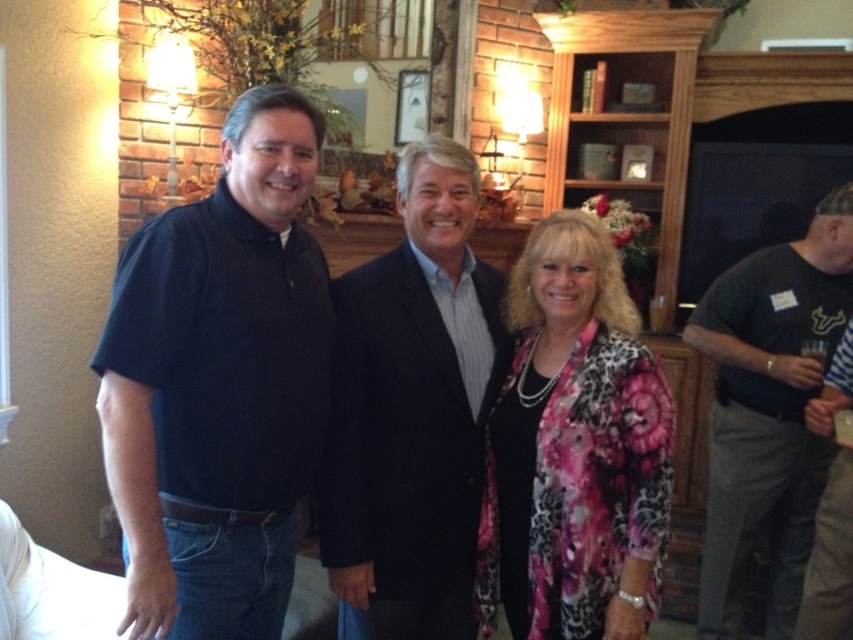
You are planning to take a photo of two people in the scene. You need to ensure that both the dark blue suit at center and the striped shirt at right are visible in the frame. Based on their positions, can you position yourself so that both are fully visible without any obstruction?

Yes, since the dark blue suit at center is in front of the striped shirt at right, positioning yourself so that you can see the dark blue suit at center from the front would allow you to also see the striped shirt at right behind it, ensuring both are visible in the frame.

You are standing in the living room and want to reach the point marked as point (403, 348). If you take three steps forward, each step covering 0.6 meters, will you reach the point?

The distance between you and point (403, 348) is 1.81 meters. Taking three steps of 0.6 meters each would cover 1.8 meters. Since 1.8 meters is slightly less than 1.81 meters, you would not quite reach the point after three steps.